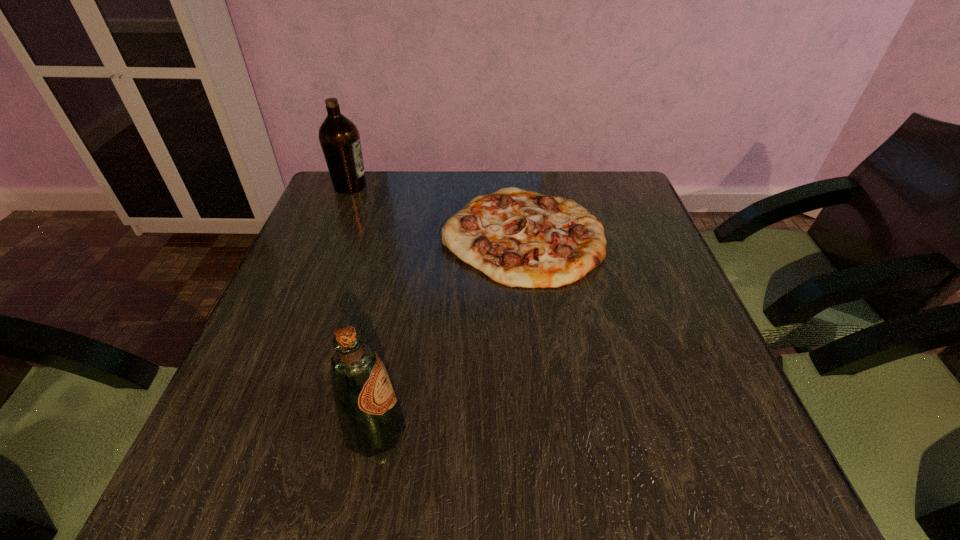
The height and width of the screenshot is (540, 960). What are the coordinates of `the left olive oil` in the screenshot? It's located at (339, 138).

This screenshot has height=540, width=960. I want to click on the farther olive oil, so click(x=339, y=138).

Locate an element on the screen. the right olive oil is located at coordinates (371, 420).

This screenshot has width=960, height=540. What are the coordinates of `the second object from left to right` in the screenshot? It's located at (371, 420).

Where is `pizza`? This screenshot has width=960, height=540. pizza is located at coordinates (518, 238).

The width and height of the screenshot is (960, 540). Find the location of `the rightmost object`. the rightmost object is located at coordinates (518, 238).

In order to click on free space located 0.080m on the label of the leftmost object in this screenshot , I will do `click(396, 186)`.

Find the location of a particular element. The width and height of the screenshot is (960, 540). free spot located 0.290m on the front-facing side of the nearer olive oil is located at coordinates (585, 430).

Where is `free space located on the front of the shortest object`? free space located on the front of the shortest object is located at coordinates [x=548, y=455].

Where is `olive oil located at the far edge`? olive oil located at the far edge is located at coordinates (339, 138).